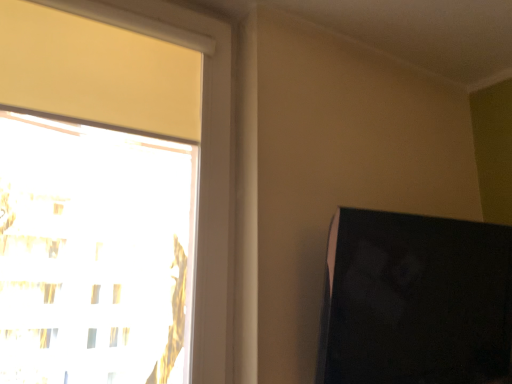
Question: Does transparent glass window at upper left have a larger size compared to matte black monitor at right?

Choices:
 (A) no
 (B) yes

Answer: (A)

Question: Is transparent glass window at upper left positioned before matte black monitor at right?

Choices:
 (A) no
 (B) yes

Answer: (B)

Question: Is transparent glass window at upper left to the right of matte black monitor at right from the viewer's perspective?

Choices:
 (A) no
 (B) yes

Answer: (A)

Question: From the image's perspective, is transparent glass window at upper left located above matte black monitor at right?

Choices:
 (A) yes
 (B) no

Answer: (A)

Question: Can you confirm if transparent glass window at upper left is smaller than matte black monitor at right?

Choices:
 (A) no
 (B) yes

Answer: (B)

Question: Is transparent glass window at upper left outside of matte black monitor at right?

Choices:
 (A) yes
 (B) no

Answer: (A)

Question: Considering the relative positions of matte black monitor at right and transparent glass window at upper left in the image provided, is matte black monitor at right to the right of transparent glass window at upper left from the viewer's perspective?

Choices:
 (A) yes
 (B) no

Answer: (A)

Question: Considering the relative sizes of matte black monitor at right and transparent glass window at upper left in the image provided, is matte black monitor at right thinner than transparent glass window at upper left?

Choices:
 (A) no
 (B) yes

Answer: (A)

Question: Is matte black monitor at right oriented away from transparent glass window at upper left?

Choices:
 (A) yes
 (B) no

Answer: (B)

Question: From the image's perspective, is matte black monitor at right located above transparent glass window at upper left?

Choices:
 (A) yes
 (B) no

Answer: (B)

Question: From a real-world perspective, is matte black monitor at right physically below transparent glass window at upper left?

Choices:
 (A) yes
 (B) no

Answer: (A)

Question: Is matte black monitor at right completely or partially outside of transparent glass window at upper left?

Choices:
 (A) no
 (B) yes

Answer: (B)

Question: From a real-world perspective, is matte black monitor at right physically located above or below transparent glass window at upper left?

Choices:
 (A) above
 (B) below

Answer: (B)